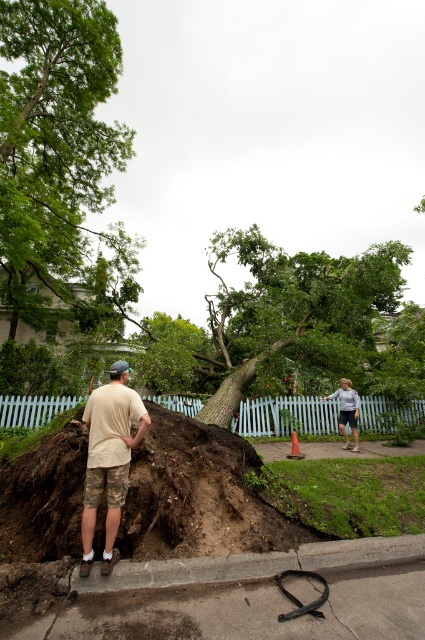
Consider the image. Is smooth concrete sidewalk at lower center to the left of gray concrete curb at lower center from the viewer's perspective?

Yes, smooth concrete sidewalk at lower center is to the left of gray concrete curb at lower center.

Between smooth concrete sidewalk at lower center and gray concrete curb at lower center, which one appears on the left side from the viewer's perspective?

Positioned to the left is smooth concrete sidewalk at lower center.

The image size is (425, 640). What do you see at coordinates (215, 609) in the screenshot? I see `smooth concrete sidewalk at lower center` at bounding box center [215, 609].

Identify the location of smooth concrete sidewalk at lower center. The height and width of the screenshot is (640, 425). (215, 609).

Does green leafy tree at upper left lie behind smooth concrete sidewalk at lower center?

Yes, it is.

Can you confirm if green leafy tree at upper left is wider than smooth concrete sidewalk at lower center?

Yes.

Does point (76, 275) come behind point (408, 596)?

Yes, it is.

Where is `green leafy tree at upper left`? The height and width of the screenshot is (640, 425). green leafy tree at upper left is located at coordinates (53, 148).

Is point (68, 596) behind point (113, 474)?

No, (68, 596) is in front of (113, 474).

Which is above, smooth concrete sidewalk at lower center or camouflage shorts at left?

Positioned higher is camouflage shorts at left.

Does point (155, 624) come behind point (121, 406)?

No, (155, 624) is in front of (121, 406).

You are a GUI agent. You are given a task and a screenshot of the screen. Output one action in this format:
    pyautogui.click(x=<x>, y=<y>)
    Task: Click on the smooth concrete sidewalk at lower center
    The width and height of the screenshot is (425, 640).
    Given the screenshot: What is the action you would take?
    pyautogui.click(x=215, y=609)